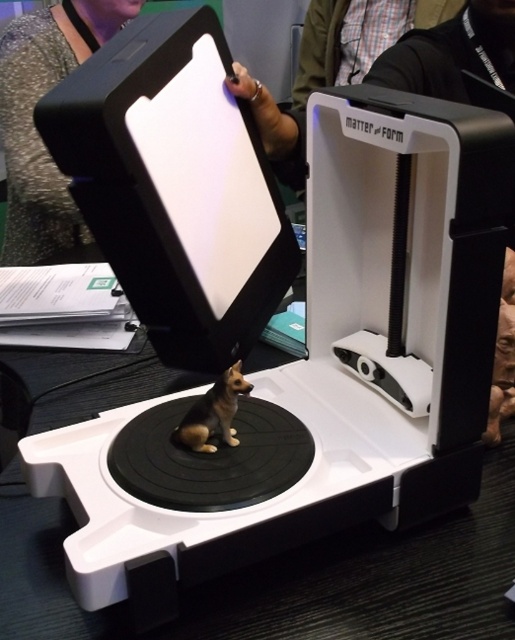
Can you confirm if sparkly silver shirt at upper left is smaller than brown matte dog at center?

Actually, sparkly silver shirt at upper left might be larger than brown matte dog at center.

Identify the location of sparkly silver shirt at upper left. (36, 129).

Is point (43, 10) more distant than point (218, 408)?

Yes, point (43, 10) is behind point (218, 408).

Locate an element on the screen. sparkly silver shirt at upper left is located at coordinates (36, 129).